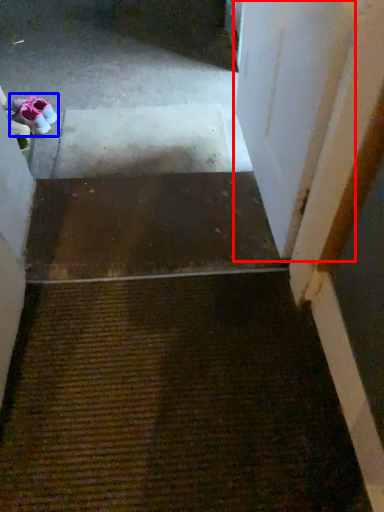
Question: Which object appears closest to the camera in this image, door (highlighted by a red box) or footwear (highlighted by a blue box)?

Choices:
 (A) door
 (B) footwear

Answer: (A)